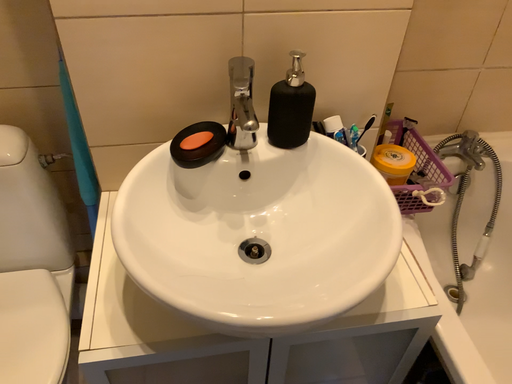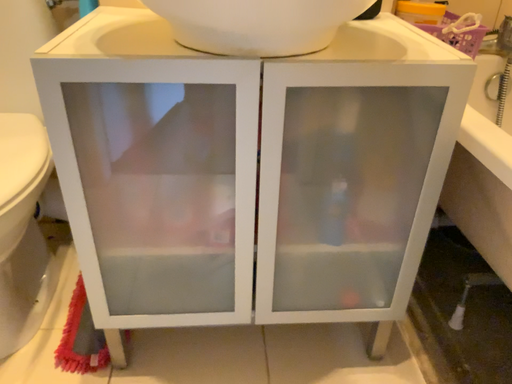
Question: How did the camera likely rotate when shooting the video?

Choices:
 (A) rotated upward
 (B) rotated downward

Answer: (A)